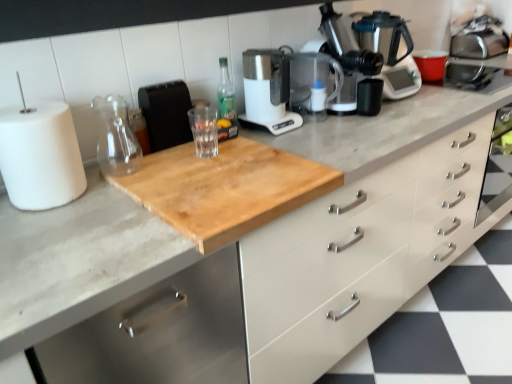
At what (x,y) coordinates should I click in order to perform the action: click on free spot to the left of black matte cup at center, which is counted as the 3th appliance, starting from the left. Please return your answer as a coordinate pair (x, y). This screenshot has height=384, width=512. Looking at the image, I should click on (331, 118).